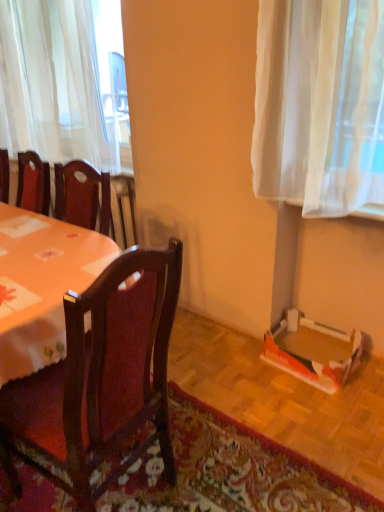
Question: Is dark wood chair at center wider than wooden table at left?

Choices:
 (A) yes
 (B) no

Answer: (A)

Question: From a real-world perspective, is dark wood chair at center below wooden table at left?

Choices:
 (A) yes
 (B) no

Answer: (A)

Question: Is dark wood chair at center positioned before wooden table at left?

Choices:
 (A) no
 (B) yes

Answer: (B)

Question: Considering the relative positions of dark wood chair at center and wooden table at left in the image provided, is dark wood chair at center to the left of wooden table at left from the viewer's perspective?

Choices:
 (A) yes
 (B) no

Answer: (A)

Question: From the image's perspective, is dark wood chair at center on top of wooden table at left?

Choices:
 (A) yes
 (B) no

Answer: (B)

Question: Does dark wood chair at center lie behind wooden table at left?

Choices:
 (A) yes
 (B) no

Answer: (B)

Question: Does floral carpet at lower right have a lesser width compared to orange cardboard box at lower right?

Choices:
 (A) no
 (B) yes

Answer: (A)

Question: From a real-world perspective, does floral carpet at lower right stand above orange cardboard box at lower right?

Choices:
 (A) yes
 (B) no

Answer: (B)

Question: Is orange cardboard box at lower right completely or partially inside floral carpet at lower right?

Choices:
 (A) yes
 (B) no

Answer: (B)

Question: Is floral carpet at lower right closer to the viewer compared to orange cardboard box at lower right?

Choices:
 (A) yes
 (B) no

Answer: (A)

Question: From the image's perspective, is floral carpet at lower right located above orange cardboard box at lower right?

Choices:
 (A) yes
 (B) no

Answer: (B)

Question: Considering the relative sizes of floral carpet at lower right and orange cardboard box at lower right in the image provided, is floral carpet at lower right wider than orange cardboard box at lower right?

Choices:
 (A) yes
 (B) no

Answer: (A)

Question: Can you confirm if floral carpet at lower right is shorter than wooden table at left?

Choices:
 (A) no
 (B) yes

Answer: (B)